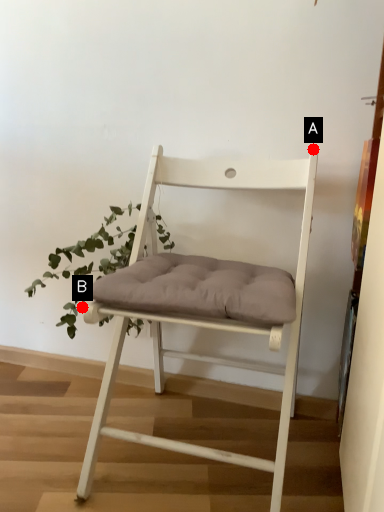
Question: Two points are circled on the image, labeled by A and B beside each circle. Which point is further to the camera?

Choices:
 (A) A is further
 (B) B is further

Answer: (B)